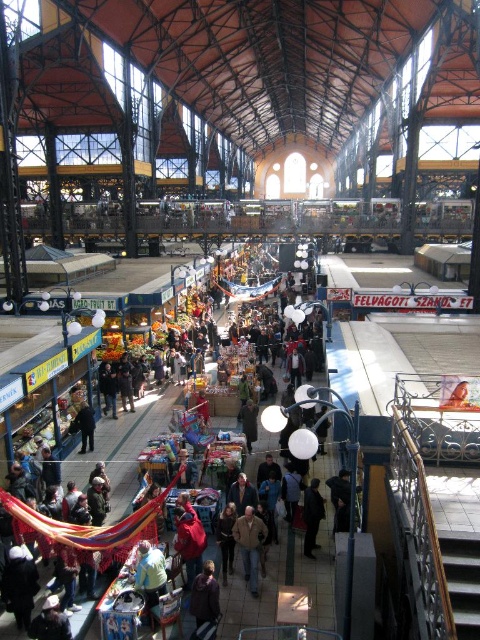
Question: Among these points, which one is farthest from the camera?

Choices:
 (A) (316, 506)
 (B) (136, 568)
 (C) (251, 588)
 (D) (215, 604)

Answer: (A)

Question: Is dark brown leather jacket at center positioned behind dark blue fabric at center?

Choices:
 (A) yes
 (B) no

Answer: (B)

Question: Which point is closer to the camera?

Choices:
 (A) (313, 481)
 (B) (199, 588)
 (C) (255, 525)
 (D) (155, 605)

Answer: (B)

Question: Among these objects, which one is farthest from the camera?

Choices:
 (A) dark brown leather jacket at center
 (B) dark blue fabric at center

Answer: (B)

Question: Does light blue fabric at center lie behind dark blue fabric at center?

Choices:
 (A) no
 (B) yes

Answer: (A)

Question: Does brown leather jacket at center come behind dark blue fabric at center?

Choices:
 (A) yes
 (B) no

Answer: (B)